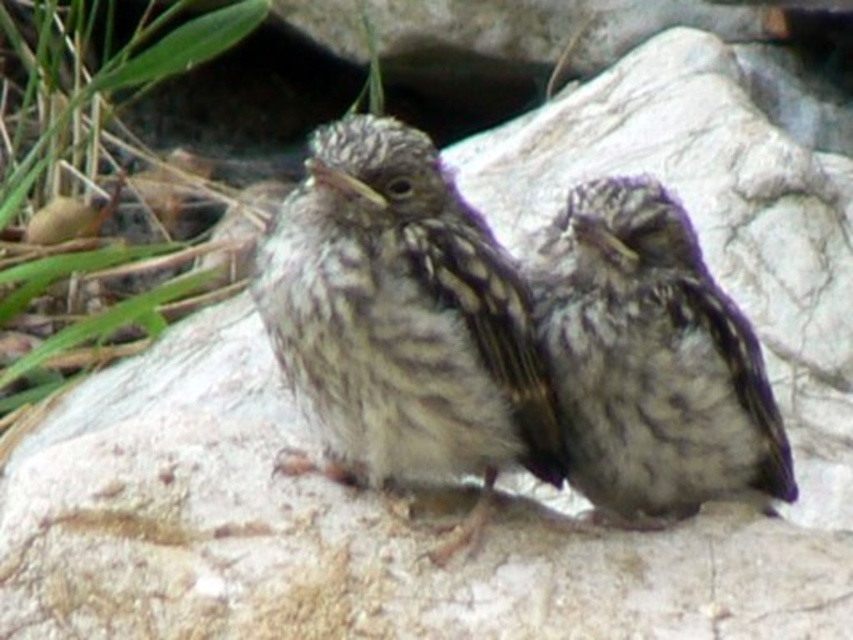
Between point (281, 209) and point (560, 346), which one is positioned behind?

The point (560, 346) is behind.

Which is above, brown speckled sparrow at center or speckled feathered sparrow at center?

brown speckled sparrow at center is above.

What are the coordinates of `brown speckled sparrow at center` in the screenshot? It's located at (401, 323).

Identify the location of brown speckled sparrow at center. The height and width of the screenshot is (640, 853). (401, 323).